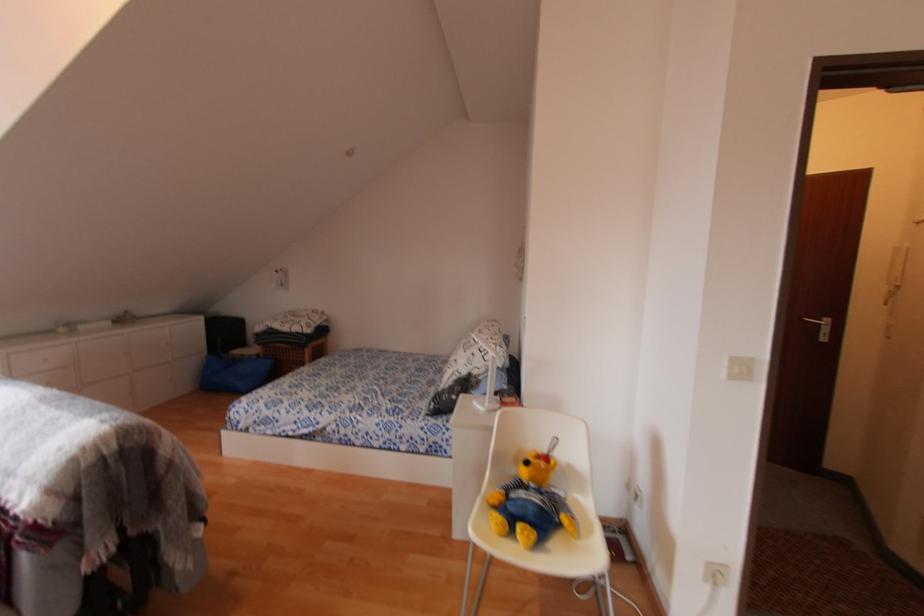
The location [530,503] corresponds to which object?

This point indicates the yellow teddy bear.